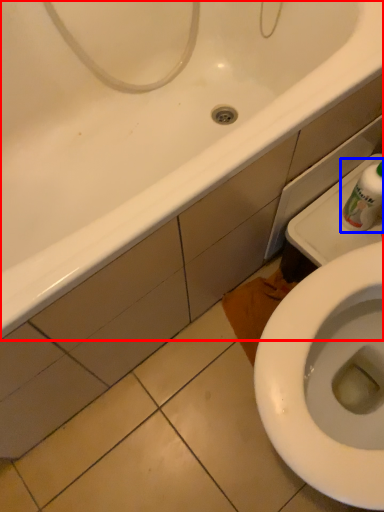
Question: Which object is further to the camera taking this photo, bathtub (highlighted by a red box) or cleaning product (highlighted by a blue box)?

Choices:
 (A) bathtub
 (B) cleaning product

Answer: (B)